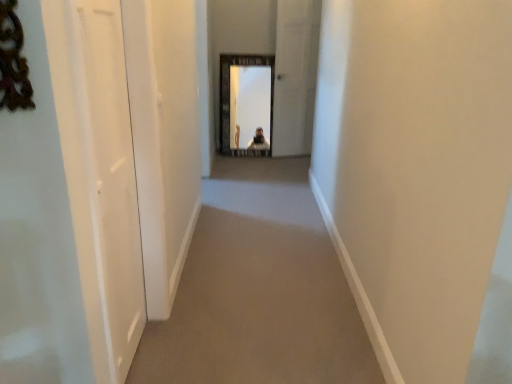
Question: Looking at the image, does white glossy door at left, the 2th screen door when ordered from back to front, seem bigger or smaller compared to white glossy door at center, the second screen door in the bottom-to-top sequence?

Choices:
 (A) small
 (B) big

Answer: (A)

Question: In terms of height, does white glossy door at left, acting as the 1th screen door starting from the front, look taller or shorter compared to white glossy door at center, which is counted as the 2th screen door, starting from the left?

Choices:
 (A) short
 (B) tall

Answer: (A)

Question: Which of these objects is positioned closest to the beige carpet at center?

Choices:
 (A) white glossy door at left, acting as the first screen door starting from the left
 (B) white glossy door at center, positioned as the 1th screen door in top-to-bottom order

Answer: (A)

Question: Estimate the real-world distances between objects in this image. Which object is closer to the white glossy door at center, the 2th screen door viewed from the front?

Choices:
 (A) white glossy door at left, the 1th screen door when ordered from bottom to top
 (B) beige carpet at center

Answer: (B)